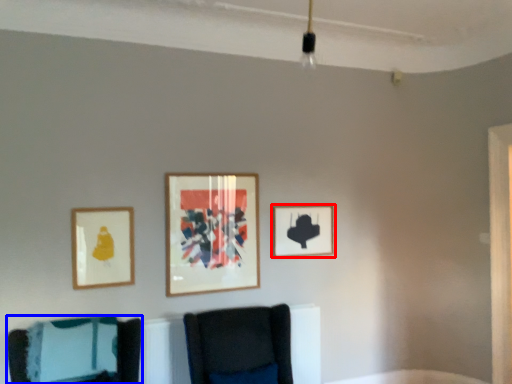
Question: Which of the following is the closest to the observer, picture frame (highlighted by a red box) or furniture (highlighted by a blue box)?

Choices:
 (A) picture frame
 (B) furniture

Answer: (B)